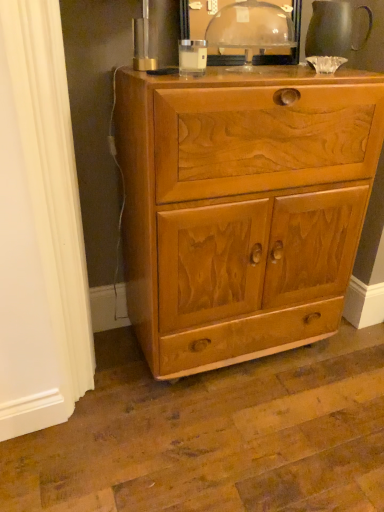
Question: In the image, is transparent plastic dome at upper center on the left side or the right side of light brown wood cabinet at center?

Choices:
 (A) right
 (B) left

Answer: (A)

Question: Is transparent plastic dome at upper center inside or outside of light brown wood cabinet at center?

Choices:
 (A) inside
 (B) outside

Answer: (B)

Question: Which object is the closest to the transparent plastic dome at upper center?

Choices:
 (A) matte gray pitcher at upper right
 (B) light brown wood cabinet at center

Answer: (A)

Question: Which object is the closest to the matte gray pitcher at upper right?

Choices:
 (A) light brown wood cabinet at center
 (B) transparent plastic dome at upper center

Answer: (B)